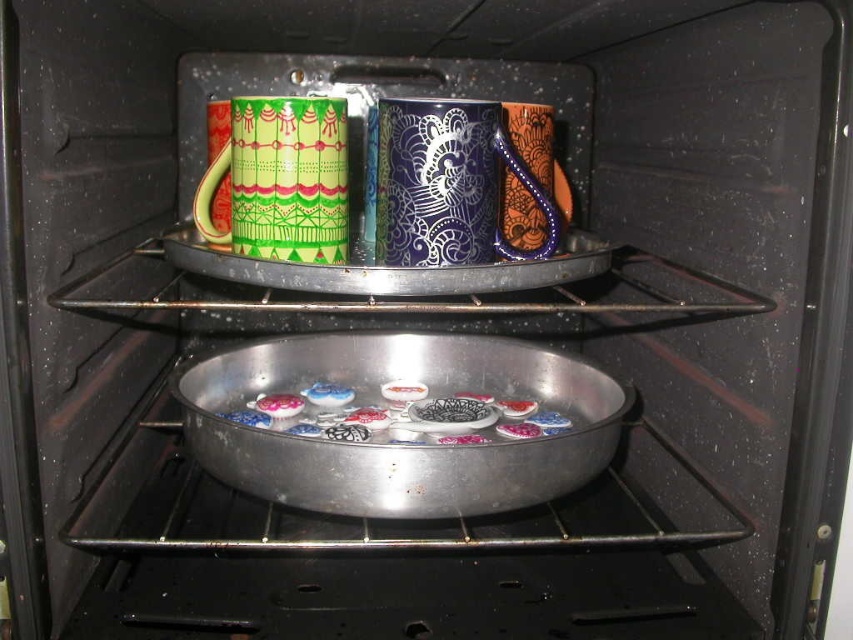
Looking at this image, you are looking into an oven with two racks. On the top rack, there are two mugs visible. One is a glossy ceramic mug at upper center and the other is a green glossy mug at upper center. Which of these two mugs is positioned closer to the front of the oven?

The glossy ceramic mug at upper center is closer to the viewer than the green glossy mug at upper center, so it is positioned closer to the front of the oven.

You are a baker checking the oven. You see the shiny metallic cookies at center and the matte ceramic button at center. Which object is wider?

The shiny metallic cookies at center might be wider than the matte ceramic button at center.

You are a kitchen assistant trying to place a new mug in the oven. You see the green glossy mug at upper center and the glossy ceramic button at center. Which object is wider?

The green glossy mug at upper center is wider than the glossy ceramic button at center.